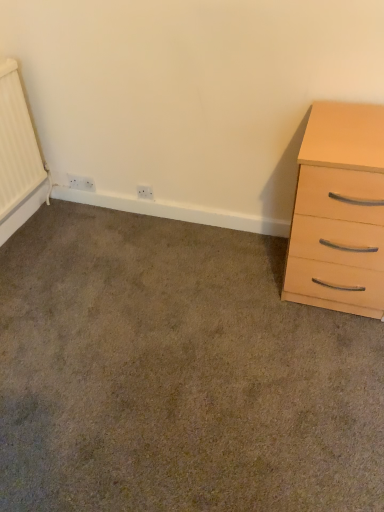
Image resolution: width=384 pixels, height=512 pixels. Find the location of `carpet at lower left`. carpet at lower left is located at coordinates (177, 374).

Describe the element at coordinates (80, 183) in the screenshot. I see `white plastic electric outlet at lower left, acting as the second electric outlet starting from the right` at that location.

This screenshot has width=384, height=512. What do you see at coordinates (339, 212) in the screenshot?
I see `light wood/veneer chest of drawers at right` at bounding box center [339, 212].

At what (x,y) coordinates should I click in order to perform the action: click on carpet at lower left. Please return your answer as a coordinate pair (x, y). Looking at the image, I should click on (177, 374).

Considering the relative positions of white plastic electric outlet at center, which appears as the 1th electric outlet when viewed from the right, and carpet at lower left in the image provided, is white plastic electric outlet at center, which appears as the 1th electric outlet when viewed from the right, to the left of carpet at lower left from the viewer's perspective?

Correct, you'll find white plastic electric outlet at center, which appears as the 1th electric outlet when viewed from the right, to the left of carpet at lower left.

Does white plastic electric outlet at center, the 2th electric outlet from the back, lie behind carpet at lower left?

Yes.

Does point (149, 195) come farther from viewer compared to point (218, 300)?

Yes, point (149, 195) is farther from viewer.

In the scene shown: How different are the orientations of carpet at lower left and white plastic electric outlet at center, the 1th electric outlet viewed from the front, in degrees?

The angular difference between carpet at lower left and white plastic electric outlet at center, the 1th electric outlet viewed from the front, is 90.7 degrees.

From the picture: Considering the sizes of objects carpet at lower left and white plastic electric outlet at center, which appears as the second electric outlet when viewed from the left, in the image provided, who is bigger, carpet at lower left or white plastic electric outlet at center, which appears as the second electric outlet when viewed from the left,?

Bigger between the two is carpet at lower left.

Is carpet at lower left at the left side of white plastic electric outlet at center, which appears as the 1th electric outlet when viewed from the right?

No.

Is carpet at lower left with white plastic electric outlet at center, the 2th electric outlet from the back?

There is a gap between carpet at lower left and white plastic electric outlet at center, the 2th electric outlet from the back.

Is the position of white plastic electric outlet at lower left, the 2th electric outlet positioned from the front, less distant than that of carpet at lower left?

No, white plastic electric outlet at lower left, the 2th electric outlet positioned from the front, is behind carpet at lower left.

From the image's perspective, is white plastic electric outlet at lower left, which appears as the 1th electric outlet when viewed from the back, located above or below carpet at lower left?

From the image's perspective, white plastic electric outlet at lower left, which appears as the 1th electric outlet when viewed from the back, appears above carpet at lower left.

Is point (81, 188) positioned in front of point (262, 240)?

No.

Which of these two, white plastic electric outlet at lower left, acting as the second electric outlet starting from the right, or carpet at lower left, stands taller?

With more height is white plastic electric outlet at lower left, acting as the second electric outlet starting from the right.

Considering the sizes of white plastic electric outlet at lower left, which is the 1th electric outlet from left to right, and white plastic electric outlet at center, the 1th electric outlet viewed from the front, in the image, is white plastic electric outlet at lower left, which is the 1th electric outlet from left to right, wider or thinner than white plastic electric outlet at center, the 1th electric outlet viewed from the front,?

In the image, white plastic electric outlet at lower left, which is the 1th electric outlet from left to right, appears to be more narrow than white plastic electric outlet at center, the 1th electric outlet viewed from the front.

From a real-world perspective, is white plastic electric outlet at lower left, which is the 1th electric outlet from left to right, under white plastic electric outlet at center, the 2th electric outlet from the back?

Yes, from a real-world perspective, white plastic electric outlet at lower left, which is the 1th electric outlet from left to right, is under white plastic electric outlet at center, the 2th electric outlet from the back.

Is point (81, 181) behind point (149, 196)?

Yes, point (81, 181) is behind point (149, 196).

How many degrees apart are the facing directions of white plastic electric outlet at lower left, the 2th electric outlet positioned from the front, and white plastic electric outlet at center, which appears as the second electric outlet when viewed from the left?

1.23 degrees.

This screenshot has height=512, width=384. In the image, there is a white plastic electric outlet at lower left, which is the 1th electric outlet from left to right. Identify the location of the chest of drawers below it (from the image's perspective). (339, 212).

Would you say white plastic electric outlet at lower left, the 2th electric outlet positioned from the front, is outside light wood/veneer chest of drawers at right?

Indeed, white plastic electric outlet at lower left, the 2th electric outlet positioned from the front, is completely outside light wood/veneer chest of drawers at right.

Between white plastic electric outlet at lower left, the 2th electric outlet positioned from the front, and light wood/veneer chest of drawers at right, which one has larger width?

light wood/veneer chest of drawers at right.

From the image's perspective, is white plastic electric outlet at center, which appears as the second electric outlet when viewed from the left, beneath light wood/veneer chest of drawers at right?

No.

Find the location of `chest of drawers that appears on the right of white plastic electric outlet at center, the 2th electric outlet from the back`. chest of drawers that appears on the right of white plastic electric outlet at center, the 2th electric outlet from the back is located at coordinates (x=339, y=212).

From a real-world perspective, is white plastic electric outlet at center, the 2th electric outlet from the back, on light wood/veneer chest of drawers at right?

No, from a real-world perspective, white plastic electric outlet at center, the 2th electric outlet from the back, is not over light wood/veneer chest of drawers at right

Between point (153, 195) and point (337, 110), which one is positioned behind?

The point (153, 195) is behind.

Is point (140, 198) behind point (81, 183)?

No, it is not.

Between white plastic electric outlet at center, which appears as the 1th electric outlet when viewed from the right, and white plastic electric outlet at lower left, which is the 1th electric outlet from left to right, which one has smaller size?

Smaller between the two is white plastic electric outlet at center, which appears as the 1th electric outlet when viewed from the right.

Who is shorter, white plastic electric outlet at center, which appears as the 1th electric outlet when viewed from the right, or white plastic electric outlet at lower left, which is the 1th electric outlet from left to right?

white plastic electric outlet at center, which appears as the 1th electric outlet when viewed from the right, is shorter.

Looking at this image, can you confirm if white plastic electric outlet at center, the 2th electric outlet from the back, is positioned to the left of white plastic electric outlet at lower left, the 2th electric outlet positioned from the front?

In fact, white plastic electric outlet at center, the 2th electric outlet from the back, is to the right of white plastic electric outlet at lower left, the 2th electric outlet positioned from the front.

At what (x,y) coordinates should I click in order to perform the action: click on concrete that is under the white plastic electric outlet at center, the 1th electric outlet viewed from the front (from a real-world perspective). Please return your answer as a coordinate pair (x, y). Image resolution: width=384 pixels, height=512 pixels. Looking at the image, I should click on (177, 374).

Identify the location of electric outlet that is the 1st one when counting upward from the carpet at lower left (from the image's perspective). (145, 192).

Based on their spatial positions, is white plastic electric outlet at center, the 1th electric outlet viewed from the front, or white plastic electric outlet at lower left, which is the 1th electric outlet from left to right, closer to carpet at lower left?

white plastic electric outlet at center, the 1th electric outlet viewed from the front, is closer to carpet at lower left.

Based on their spatial positions, is white plastic electric outlet at center, the 1th electric outlet viewed from the front, or white plastic electric outlet at lower left, which appears as the 1th electric outlet when viewed from the back, closer to light wood/veneer chest of drawers at right?

The object closer to light wood/veneer chest of drawers at right is white plastic electric outlet at center, the 1th electric outlet viewed from the front.

Which object lies further to the anchor point carpet at lower left, white plastic electric outlet at center, the 2th electric outlet from the back, or light wood/veneer chest of drawers at right?

white plastic electric outlet at center, the 2th electric outlet from the back, lies further to carpet at lower left than the other object.

Estimate the real-world distances between objects in this image. Which object is closer to white plastic electric outlet at center, which appears as the second electric outlet when viewed from the left, light wood/veneer chest of drawers at right or carpet at lower left?

carpet at lower left.

Looking at the image, which one is located closer to white plastic electric outlet at lower left, the 2th electric outlet positioned from the front, carpet at lower left or light wood/veneer chest of drawers at right?

carpet at lower left.

Considering their positions, is white plastic electric outlet at lower left, acting as the second electric outlet starting from the right, positioned closer to light wood/veneer chest of drawers at right than carpet at lower left?

carpet at lower left is positioned closer to the anchor light wood/veneer chest of drawers at right.

Which object lies nearer to the anchor point light wood/veneer chest of drawers at right, white plastic electric outlet at lower left, acting as the second electric outlet starting from the right, or white plastic electric outlet at center, which appears as the 1th electric outlet when viewed from the right?

Based on the image, white plastic electric outlet at center, which appears as the 1th electric outlet when viewed from the right, appears to be nearer to light wood/veneer chest of drawers at right.

Based on their spatial positions, is carpet at lower left or white plastic electric outlet at lower left, the 2th electric outlet positioned from the front, further from white plastic electric outlet at center, which appears as the 1th electric outlet when viewed from the right?

carpet at lower left is positioned further to the anchor white plastic electric outlet at center, which appears as the 1th electric outlet when viewed from the right.

Find the location of `chest of drawers between carpet at lower left and white plastic electric outlet at center, which appears as the second electric outlet when viewed from the left, in the front-back direction`. chest of drawers between carpet at lower left and white plastic electric outlet at center, which appears as the second electric outlet when viewed from the left, in the front-back direction is located at coordinates (339, 212).

Where is `electric outlet between white plastic electric outlet at lower left, acting as the second electric outlet starting from the right, and light wood/veneer chest of drawers at right, in the horizontal direction`? electric outlet between white plastic electric outlet at lower left, acting as the second electric outlet starting from the right, and light wood/veneer chest of drawers at right, in the horizontal direction is located at coordinates click(145, 192).

What are the coordinates of `chest of drawers between carpet at lower left and white plastic electric outlet at lower left, acting as the second electric outlet starting from the right, from front to back` in the screenshot? It's located at (339, 212).

Find the location of `electric outlet between carpet at lower left and white plastic electric outlet at lower left, which is the 1th electric outlet from left to right, along the z-axis`. electric outlet between carpet at lower left and white plastic electric outlet at lower left, which is the 1th electric outlet from left to right, along the z-axis is located at coordinates (145, 192).